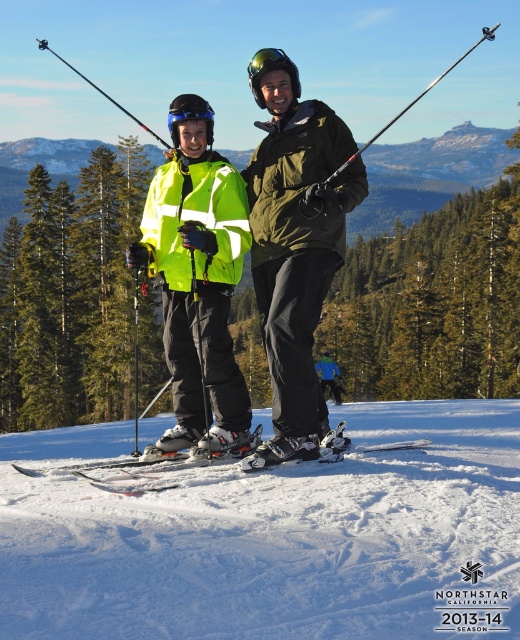
From the picture: You are a ski instructor observing the scene. You need to determine which object is closer to the ground between the white matte skis at center and the blue fabric jacket at center. Which one is closer?

The white matte skis at center are closer to the ground because they have a lesser height compared to the blue fabric jacket at center.